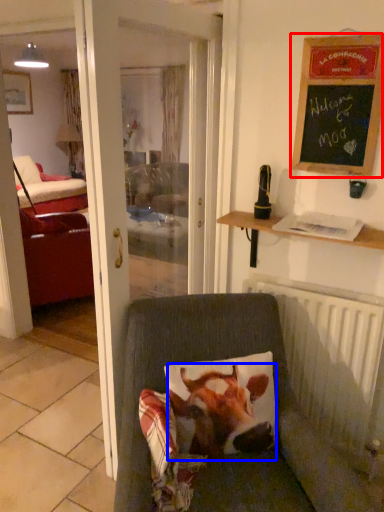
Question: Which object appears closest to the camera in this image, bulletin board (highlighted by a red box) or cattle (highlighted by a blue box)?

Choices:
 (A) bulletin board
 (B) cattle

Answer: (B)